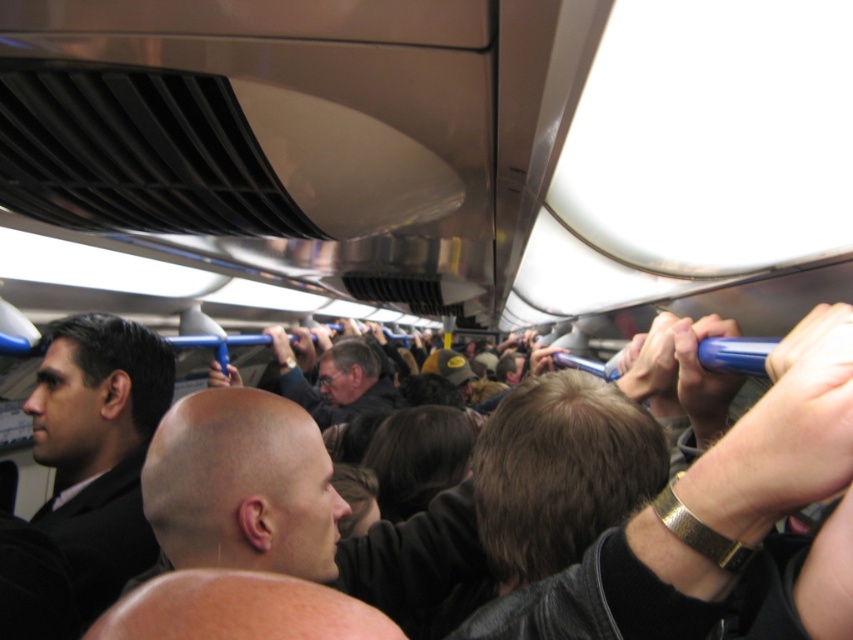
Which is more to the left, bald head at center or dark brown suit at left?

dark brown suit at left is more to the left.

Who is higher up, bald head at center or dark brown suit at left?

bald head at center is higher up.

Locate an element on the screen. This screenshot has width=853, height=640. bald head at center is located at coordinates [x=242, y=486].

From the picture: Who is lower down, bald head at center or dark gray sweater at center?

dark gray sweater at center

Does bald head at center have a lesser height compared to dark gray sweater at center?

Indeed, bald head at center has a lesser height compared to dark gray sweater at center.

Who is more forward, (312, 493) or (317, 413)?

Point (312, 493)

Find the location of `bald head at center`. bald head at center is located at coordinates (242, 486).

Can you confirm if dark brown suit at left is positioned to the right of dark gray sweater at center?

In fact, dark brown suit at left is to the left of dark gray sweater at center.

Does dark brown suit at left have a greater width compared to dark gray sweater at center?

Incorrect, dark brown suit at left's width does not surpass dark gray sweater at center's.

Where is `dark brown suit at left`? The image size is (853, 640). dark brown suit at left is located at coordinates (97, 448).